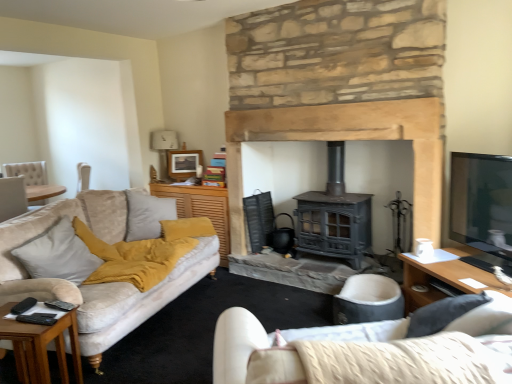
Question: Which direction should I rotate to look at yellow fabric cushion at center, the 2th table positioned from the left?

Choices:
 (A) right
 (B) left

Answer: (B)

Question: Does matte black stove at center appear on the left side of white fabric lampshade at upper center?

Choices:
 (A) no
 (B) yes

Answer: (A)

Question: From a real-world perspective, is matte black stove at center beneath white fabric lampshade at upper center?

Choices:
 (A) no
 (B) yes

Answer: (B)

Question: From the image's perspective, does matte black stove at center appear lower than white fabric lampshade at upper center?

Choices:
 (A) no
 (B) yes

Answer: (B)

Question: Considering the relative sizes of matte black stove at center and white fabric lampshade at upper center in the image provided, is matte black stove at center bigger than white fabric lampshade at upper center?

Choices:
 (A) yes
 (B) no

Answer: (A)

Question: Does matte black stove at center have a lesser height compared to white fabric lampshade at upper center?

Choices:
 (A) yes
 (B) no

Answer: (B)

Question: Does matte black stove at center lie behind white fabric lampshade at upper center?

Choices:
 (A) no
 (B) yes

Answer: (A)

Question: Can you confirm if yellow fabric cushion at center, which ranks as the 2th table in bottom-to-top order, is wider than wooden picture frame at upper center?

Choices:
 (A) no
 (B) yes

Answer: (B)

Question: From a real-world perspective, is yellow fabric cushion at center, positioned as the second table in front-to-back order, physically above wooden picture frame at upper center?

Choices:
 (A) yes
 (B) no

Answer: (B)

Question: Considering the relative sizes of yellow fabric cushion at center, the first table when ordered from back to front, and wooden picture frame at upper center in the image provided, is yellow fabric cushion at center, the first table when ordered from back to front, bigger than wooden picture frame at upper center?

Choices:
 (A) yes
 (B) no

Answer: (A)

Question: Is yellow fabric cushion at center, the 2th table positioned from the left, positioned with its back to wooden picture frame at upper center?

Choices:
 (A) no
 (B) yes

Answer: (B)

Question: From the image's perspective, is yellow fabric cushion at center, positioned as the second table in front-to-back order, located above wooden picture frame at upper center?

Choices:
 (A) yes
 (B) no

Answer: (B)

Question: From a real-world perspective, is yellow fabric cushion at center, the 1th table when ordered from top to bottom, positioned under wooden picture frame at upper center based on gravity?

Choices:
 (A) no
 (B) yes

Answer: (B)

Question: Considering the relative sizes of wooden side table at lower left, which is counted as the second table, starting from the top, and soft beige cushion at left in the image provided, is wooden side table at lower left, which is counted as the second table, starting from the top, bigger than soft beige cushion at left?

Choices:
 (A) yes
 (B) no

Answer: (B)